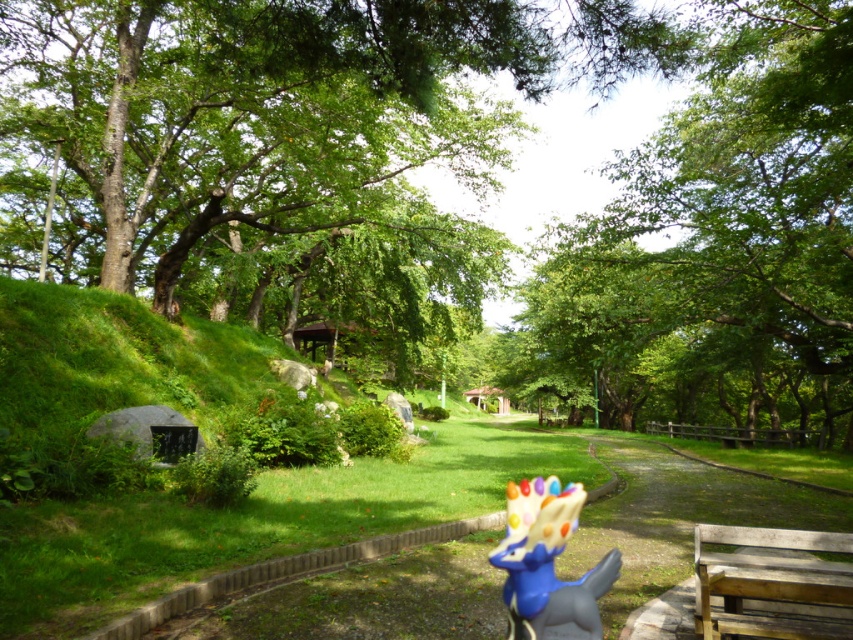
You are a child who wants to reach the shiny plastic toy at center from the wooden bench at lower right. Can you walk directly to it without stepping on any obstacles? The path is clear and there are no obstacles between them.

The wooden bench at lower right and shiny plastic toy at center are 6.11 feet apart. Since the path is clear and there are no obstacles between them, you can walk directly to the shiny plastic toy at center from the wooden bench at lower right.

You are a child visiting the park and want to play with the shiny plastic toy at center. You notice a green leafy tree at upper center nearby. Which object is taller?

The green leafy tree at upper center is much taller than the shiny plastic toy at center.